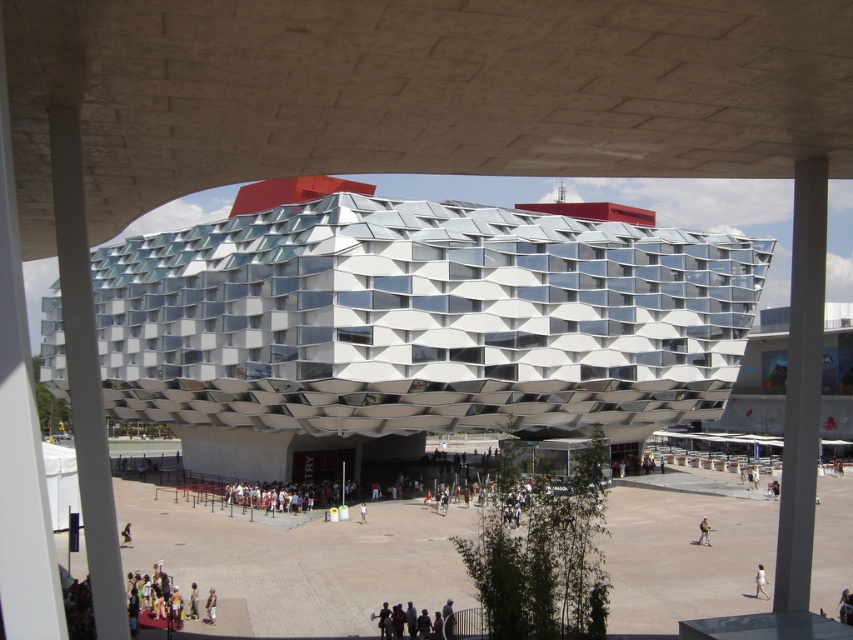
Question: Estimate the real-world distances between objects in this image. Which object is closer to the light brown fabric jacket at lower center?

Choices:
 (A) white textured building at center
 (B) white matte person at lower right
 (C) dark gray fabric people at lower center

Answer: (B)

Question: In this image, where is tan fabric shorts at lower center located relative to light brown fabric jacket at lower center?

Choices:
 (A) above
 (B) below

Answer: (A)

Question: Is white textured building at center wider than light brown fabric jacket at lower center?

Choices:
 (A) yes
 (B) no

Answer: (A)

Question: Which point is closer to the camera?

Choices:
 (A) (763, 595)
 (B) (206, 604)

Answer: (B)

Question: Which point is farther to the camera?

Choices:
 (A) tan fabric shorts at lower center
 (B) dark gray fabric people at lower center

Answer: (A)

Question: Can you confirm if white textured building at center is positioned to the left of white matte person at lower right?

Choices:
 (A) no
 (B) yes

Answer: (B)